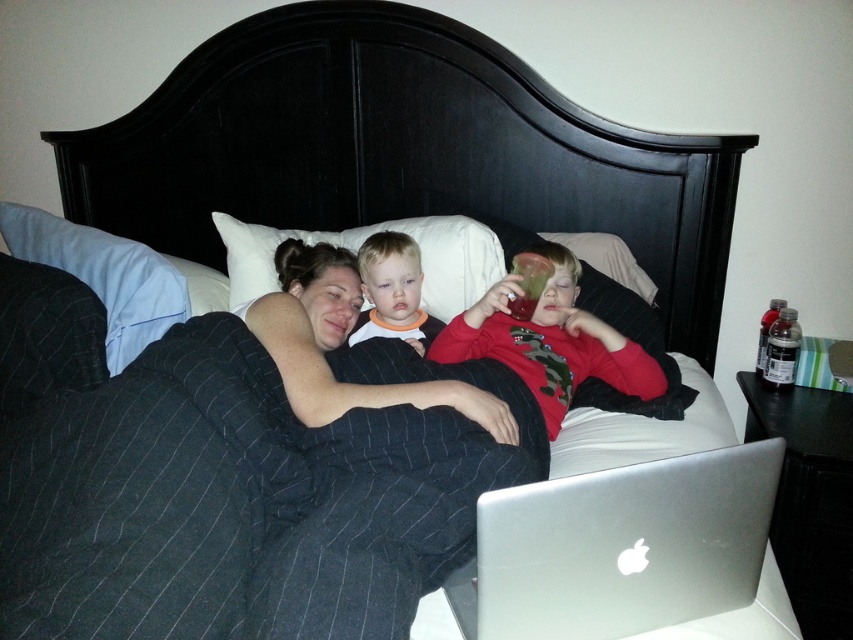
Question: Is blue fabric pillow at upper left in front of white soft pillow at center?

Choices:
 (A) no
 (B) yes

Answer: (B)

Question: Does silver metallic laptop at lower right appear on the right side of smooth orange shirt at center?

Choices:
 (A) yes
 (B) no

Answer: (A)

Question: Based on their relative distances, which object is nearer to the blue fabric pillow at upper left?

Choices:
 (A) red matte shirt at center
 (B) dark wood headboard at upper center
 (C) silver metallic laptop at lower right

Answer: (B)

Question: Which point is closer to the camera?

Choices:
 (A) matte black blanket at center
 (B) smooth orange shirt at center
 (C) dark wood headboard at upper center

Answer: (A)

Question: Is the position of dark wood headboard at upper center less distant than that of smooth orange shirt at center?

Choices:
 (A) no
 (B) yes

Answer: (A)

Question: Which point appears farthest from the camera in this image?

Choices:
 (A) (235, 497)
 (B) (248, 237)

Answer: (B)